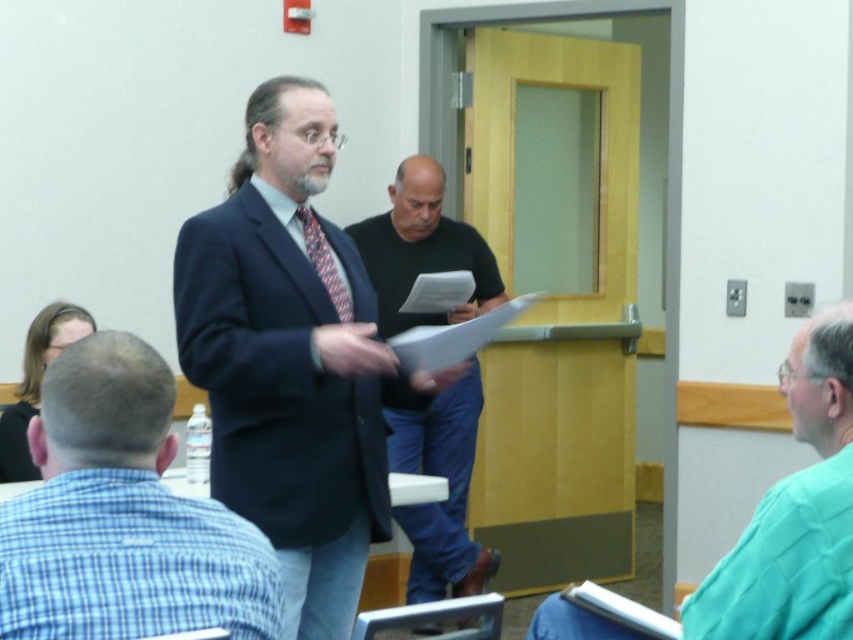
Question: Which is nearer to the green fabric shirt at right?

Choices:
 (A) patterned silk tie at center
 (B) black cotton shirt at center
 (C) white paper at center

Answer: (C)

Question: Which point is farther to the camera?

Choices:
 (A) patterned silk tie at center
 (B) matte black suit at center
 (C) black cotton shirt at center
 (D) blue plaid shirt at center

Answer: (C)

Question: Is green fabric shirt at right in front of patterned silk tie at center?

Choices:
 (A) yes
 (B) no

Answer: (A)

Question: Which object is farther from the camera taking this photo?

Choices:
 (A) green fabric shirt at right
 (B) black cotton shirt at center
 (C) matte black suit at center
 (D) blue plaid shirt at center

Answer: (B)

Question: Can you confirm if blue plaid shirt at center is smaller than black cotton shirt at center?

Choices:
 (A) no
 (B) yes

Answer: (B)

Question: Does blue plaid shirt at center appear under green fabric shirt at right?

Choices:
 (A) no
 (B) yes

Answer: (A)